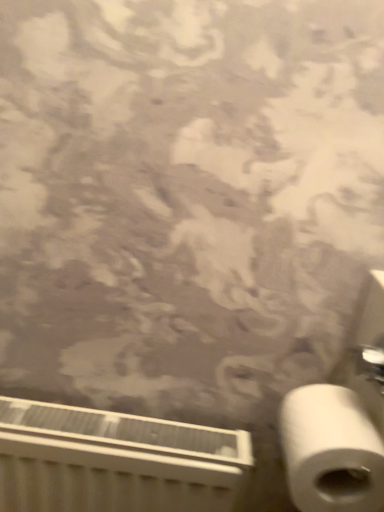
The width and height of the screenshot is (384, 512). Describe the element at coordinates (115, 461) in the screenshot. I see `white plastic radiator at lower left` at that location.

You are a GUI agent. You are given a task and a screenshot of the screen. Output one action in this format:
    pyautogui.click(x=<x>, y=<y>)
    Task: Click on the white plastic radiator at lower left
    The image size is (384, 512).
    Given the screenshot: What is the action you would take?
    pyautogui.click(x=115, y=461)

Identify the location of white matte toilet paper at lower right. Image resolution: width=384 pixels, height=512 pixels. (331, 450).

Image resolution: width=384 pixels, height=512 pixels. Describe the element at coordinates (331, 450) in the screenshot. I see `white matte toilet paper at lower right` at that location.

I want to click on white plastic radiator at lower left, so click(x=115, y=461).

Based on the photo, considering the positions of objects white matte toilet paper at lower right and white plastic radiator at lower left in the image provided, who is more to the left, white matte toilet paper at lower right or white plastic radiator at lower left?

white plastic radiator at lower left is more to the left.

Which object is more forward, white matte toilet paper at lower right or white plastic radiator at lower left?

Positioned in front is white matte toilet paper at lower right.

Is point (320, 455) farther from camera compared to point (12, 424)?

No, (320, 455) is closer to viewer.

From the image's perspective, would you say white matte toilet paper at lower right is positioned over white plastic radiator at lower left?

Indeed, from the image's perspective, white matte toilet paper at lower right is shown above white plastic radiator at lower left.

From a real-world perspective, is white matte toilet paper at lower right on white plastic radiator at lower left?

Yes, from a real-world perspective, white matte toilet paper at lower right is above white plastic radiator at lower left.

Is white matte toilet paper at lower right wider or thinner than white plastic radiator at lower left?

Considering their sizes, white matte toilet paper at lower right looks broader than white plastic radiator at lower left.

Which of these two, white matte toilet paper at lower right or white plastic radiator at lower left, stands taller?

Standing taller between the two is white plastic radiator at lower left.

Is white matte toilet paper at lower right smaller than white plastic radiator at lower left?

Yes, white matte toilet paper at lower right is smaller than white plastic radiator at lower left.

Would you say white matte toilet paper at lower right is inside or outside white plastic radiator at lower left?

white matte toilet paper at lower right cannot be found inside white plastic radiator at lower left.

Is white matte toilet paper at lower right far from white plastic radiator at lower left?

No, white matte toilet paper at lower right is not far from white plastic radiator at lower left.

Could you tell me if white matte toilet paper at lower right is facing white plastic radiator at lower left?

No, white matte toilet paper at lower right is not aimed at white plastic radiator at lower left.

You are a GUI agent. You are given a task and a screenshot of the screen. Output one action in this format:
    pyautogui.click(x=<x>, y=<y>)
    Task: Click on the radiator located below the white matte toilet paper at lower right (from the image's perspective)
    The height and width of the screenshot is (512, 384).
    Given the screenshot: What is the action you would take?
    pyautogui.click(x=115, y=461)

Would you say white plastic radiator at lower left is to the left or to the right of white matte toilet paper at lower right in the picture?

Based on their positions, white plastic radiator at lower left is located to the left of white matte toilet paper at lower right.

Which object is further away from the camera, white plastic radiator at lower left or white matte toilet paper at lower right?

white plastic radiator at lower left is further away from the camera.

Does point (189, 510) appear closer or farther from the camera than point (291, 415)?

Point (189, 510) appears to be farther away from the viewer than point (291, 415).

From the image's perspective, is white plastic radiator at lower left located above or below white matte toilet paper at lower right?

white plastic radiator at lower left is situated lower than white matte toilet paper at lower right in the image.

In the scene shown: From a real-world perspective, who is located higher, white plastic radiator at lower left or white matte toilet paper at lower right?

white matte toilet paper at lower right.

Considering the relative sizes of white plastic radiator at lower left and white matte toilet paper at lower right in the image provided, is white plastic radiator at lower left thinner than white matte toilet paper at lower right?

Yes, white plastic radiator at lower left is thinner than white matte toilet paper at lower right.

Can you confirm if white plastic radiator at lower left is shorter than white matte toilet paper at lower right?

No, white plastic radiator at lower left is not shorter than white matte toilet paper at lower right.

Between white plastic radiator at lower left and white matte toilet paper at lower right, which one has larger size?

white plastic radiator at lower left.

Is white plastic radiator at lower left not within white matte toilet paper at lower right?

Yes, white plastic radiator at lower left is outside of white matte toilet paper at lower right.

Is white plastic radiator at lower left placed right next to white matte toilet paper at lower right?

There is a gap between white plastic radiator at lower left and white matte toilet paper at lower right.

Is white plastic radiator at lower left oriented towards white matte toilet paper at lower right?

No, white plastic radiator at lower left is not oriented towards white matte toilet paper at lower right.

At what (x,y) coordinates should I click in order to perform the action: click on radiator on the left of the white matte toilet paper at lower right. Please return your answer as a coordinate pair (x, y). Image resolution: width=384 pixels, height=512 pixels. Looking at the image, I should click on (115, 461).

In the image, there is a white matte toilet paper at lower right. Identify the location of radiator below it (from a real-world perspective). Image resolution: width=384 pixels, height=512 pixels. (115, 461).

The image size is (384, 512). In order to click on radiator behind the white matte toilet paper at lower right in this screenshot , I will do `click(115, 461)`.